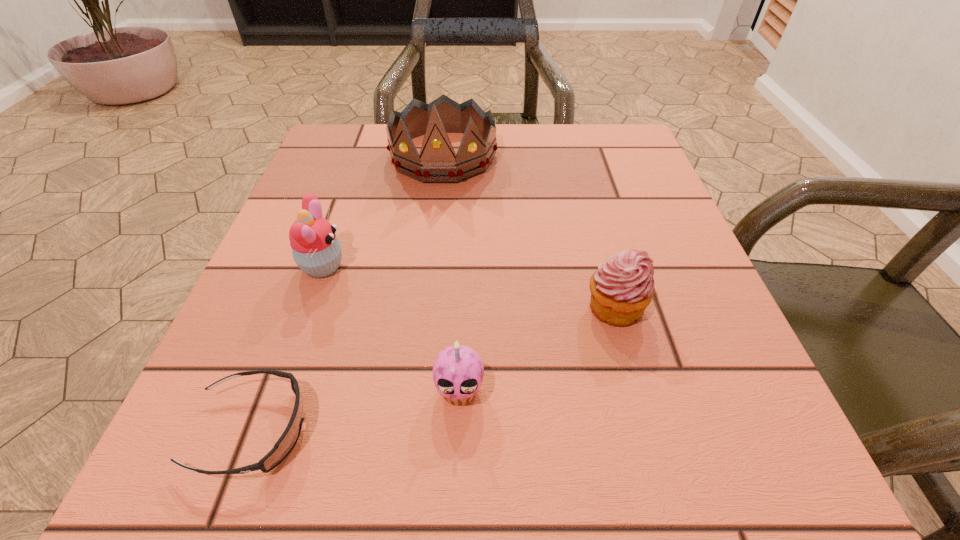
This screenshot has height=540, width=960. In order to click on tiara in this screenshot , I will do `click(437, 162)`.

Where is `the tallest object`? The image size is (960, 540). the tallest object is located at coordinates coord(437,162).

What are the coordinates of `the leftmost cupcake` in the screenshot? It's located at (316, 250).

Locate an element on the screen. the rightmost object is located at coordinates (621, 288).

At what (x,y) coordinates should I click in order to perform the action: click on the second cupcake from left to right. Please return your answer as a coordinate pair (x, y). Image resolution: width=960 pixels, height=540 pixels. Looking at the image, I should click on (458, 372).

I want to click on goggles, so click(286, 442).

This screenshot has width=960, height=540. Find the location of `free location located 0.210m at the front of the farthest object with jewels`. free location located 0.210m at the front of the farthest object with jewels is located at coordinates (432, 259).

This screenshot has width=960, height=540. I want to click on free space located on the face of the leftmost cupcake, so click(574, 267).

I want to click on free point located 0.180m on the back of the rightmost object, so click(589, 216).

The height and width of the screenshot is (540, 960). Find the location of `free region located 0.060m on the face of the nearest cupcake`. free region located 0.060m on the face of the nearest cupcake is located at coordinates (457, 461).